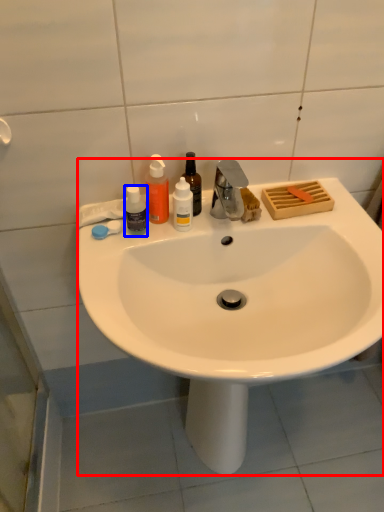
Question: Among these objects, which one is nearest to the camera, sink (highlighted by a red box) or bottle (highlighted by a blue box)?

Choices:
 (A) sink
 (B) bottle

Answer: (A)